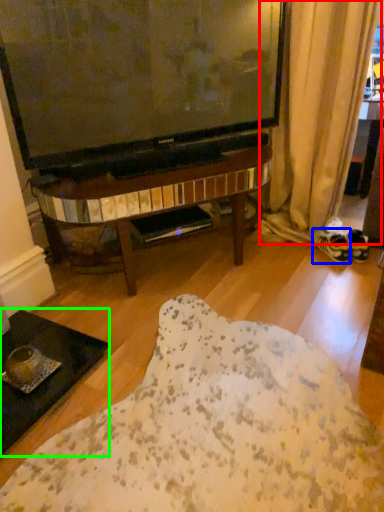
Question: Considering the real-world distances, which object is farthest from curtain (highlighted by a red box)? footwear (highlighted by a blue box) or coffee table (highlighted by a green box)?

Choices:
 (A) footwear
 (B) coffee table

Answer: (B)